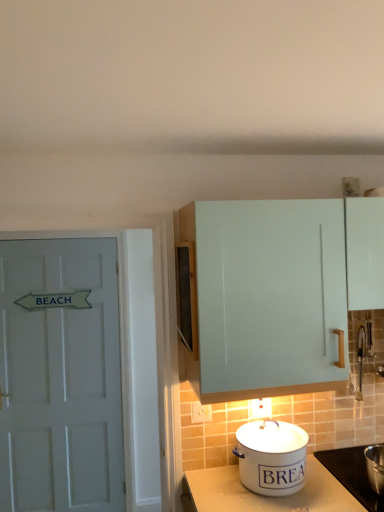
What do you see at coordinates (277, 293) in the screenshot?
I see `light blue matte cabinet at upper right` at bounding box center [277, 293].

This screenshot has width=384, height=512. Find the location of `light blue matte cabinet at upper right`. light blue matte cabinet at upper right is located at coordinates (277, 293).

Does light blue matte cabinet at upper right have a greater height compared to white painted wood door at left?

In fact, light blue matte cabinet at upper right may be shorter than white painted wood door at left.

From a real-world perspective, is light blue matte cabinet at upper right positioned above or below white painted wood door at left?

light blue matte cabinet at upper right is situated higher than white painted wood door at left in the real world.

Which point is more distant from viewer, (204, 337) or (110, 269)?

The point (110, 269) is more distant.

Considering the sizes of light blue matte cabinet at upper right and white painted wood door at left in the image, is light blue matte cabinet at upper right wider or thinner than white painted wood door at left?

In the image, light blue matte cabinet at upper right appears to be wider than white painted wood door at left.

From a real-world perspective, is white painted wood door at left positioned under light blue matte cabinet at upper right based on gravity?

Correct, in the physical world, white painted wood door at left is lower than light blue matte cabinet at upper right.

Which is behind, white painted wood door at left or light blue matte cabinet at upper right?

white painted wood door at left is further from the camera.

From the image's perspective, who appears lower, white painted wood door at left or light blue matte cabinet at upper right?

white painted wood door at left.

Considering the positions of points (60, 295) and (252, 298), is point (60, 295) farther from camera compared to point (252, 298)?

That is True.

Would you consider white enamel pot at lower right to be distant from white painted wood door at left?

Yes, white enamel pot at lower right and white painted wood door at left are quite far apart.

You are a GUI agent. You are given a task and a screenshot of the screen. Output one action in this format:
    pyautogui.click(x=<x>, y=<y>)
    Task: Click on the appliance in front of the white painted wood door at left
    
    Given the screenshot: What is the action you would take?
    pyautogui.click(x=352, y=474)

Based on their positions, is white enamel pot at lower right located to the left or right of white painted wood door at left?

white enamel pot at lower right is positioned on white painted wood door at left's right side.

From a real-world perspective, who is located lower, white enamel pot at lower right or white painted wood door at left?

In real-world perspective, white enamel pot at lower right is lower.

Considering the relative sizes of white enamel bread bin at lower center and white enamel pot at lower right in the image provided, is white enamel bread bin at lower center smaller than white enamel pot at lower right?

Incorrect, white enamel bread bin at lower center is not smaller in size than white enamel pot at lower right.

Which is more to the left, white enamel bread bin at lower center or white enamel pot at lower right?

From the viewer's perspective, white enamel bread bin at lower center appears more on the left side.

Is point (279, 443) more distant than point (357, 451)?

No, it is not.

In terms of height, does light blue matte cabinet at upper right look taller or shorter compared to white enamel pot at lower right?

Clearly, light blue matte cabinet at upper right is taller compared to white enamel pot at lower right.

Is light blue matte cabinet at upper right to the right of white enamel pot at lower right from the viewer's perspective?

In fact, light blue matte cabinet at upper right is to the left of white enamel pot at lower right.

Locate an element on the screen. This screenshot has height=512, width=384. appliance on the right of light blue matte cabinet at upper right is located at coordinates (352, 474).

Is point (341, 350) positioned after point (355, 488)?

No, it is in front of (355, 488).

How many degrees apart are the facing directions of white enamel pot at lower right and light blue matte cabinet at upper right?

The angle between the facing direction of white enamel pot at lower right and the facing direction of light blue matte cabinet at upper right is 0.0141 degrees.

Looking at this image, would you say white enamel pot at lower right is outside light blue matte cabinet at upper right?

white enamel pot at lower right is positioned outside light blue matte cabinet at upper right.

From the picture: From the image's perspective, is white enamel pot at lower right located beneath light blue matte cabinet at upper right?

Yes.

Looking at this image, is white enamel bread bin at lower center aimed at white painted wood door at left?

No, white enamel bread bin at lower center is not aimed at white painted wood door at left.

Considering the relative positions of white enamel bread bin at lower center and white painted wood door at left in the image provided, is white enamel bread bin at lower center behind white painted wood door at left?

No, white enamel bread bin at lower center is closer to the viewer.

In terms of height, does white enamel bread bin at lower center look taller or shorter compared to white painted wood door at left?

Considering their sizes, white enamel bread bin at lower center has less height than white painted wood door at left.

Considering the sizes of objects white enamel bread bin at lower center and white painted wood door at left in the image provided, who is bigger, white enamel bread bin at lower center or white painted wood door at left?

Bigger between the two is white painted wood door at left.

Locate an element on the screen. door located on the left of light blue matte cabinet at upper right is located at coordinates (60, 376).

Where is `door that appears behind the light blue matte cabinet at upper right`? The height and width of the screenshot is (512, 384). door that appears behind the light blue matte cabinet at upper right is located at coordinates (60, 376).

Considering their positions, is light blue matte cabinet at upper right positioned further to white enamel bread bin at lower center than white painted wood door at left?

Among the two, white painted wood door at left is located further to white enamel bread bin at lower center.

From the image, which object appears to be nearer to light blue matte cabinet at upper right, white enamel bread bin at lower center or white painted wood door at left?

white enamel bread bin at lower center is closer to light blue matte cabinet at upper right.

Based on their spatial positions, is white enamel bread bin at lower center or light blue matte cabinet at upper right further from white painted wood door at left?

Among the two, light blue matte cabinet at upper right is located further to white painted wood door at left.

Which object lies further to the anchor point white enamel bread bin at lower center, white enamel pot at lower right or light blue matte cabinet at upper right?

Based on the image, light blue matte cabinet at upper right appears to be further to white enamel bread bin at lower center.

In the scene shown: Looking at the image, which one is located further to white enamel pot at lower right, white painted wood door at left or white enamel bread bin at lower center?

The object further to white enamel pot at lower right is white painted wood door at left.

Estimate the real-world distances between objects in this image. Which object is further from light blue matte cabinet at upper right, white enamel pot at lower right or white enamel bread bin at lower center?

white enamel pot at lower right lies further to light blue matte cabinet at upper right than the other object.

Based on their spatial positions, is white painted wood door at left or white enamel pot at lower right further from white enamel bread bin at lower center?

Based on the image, white painted wood door at left appears to be further to white enamel bread bin at lower center.

Looking at the image, which one is located closer to light blue matte cabinet at upper right, white painted wood door at left or white enamel pot at lower right?

Based on the image, white enamel pot at lower right appears to be nearer to light blue matte cabinet at upper right.

The image size is (384, 512). I want to click on kitchen appliance situated between white painted wood door at left and white enamel pot at lower right from left to right, so click(x=272, y=457).

In order to click on kitchen appliance between white painted wood door at left and light blue matte cabinet at upper right in this screenshot , I will do `click(272, 457)`.

The height and width of the screenshot is (512, 384). Identify the location of kitchen appliance between light blue matte cabinet at upper right and white enamel pot at lower right in the up-down direction. (272, 457).

Find the location of `cabinetry located between white painted wood door at left and white enamel pot at lower right in the left-right direction`. cabinetry located between white painted wood door at left and white enamel pot at lower right in the left-right direction is located at coordinates click(x=277, y=293).